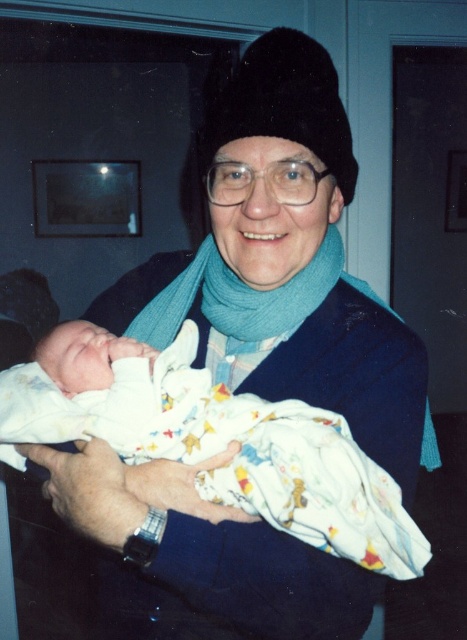
Question: Is white cotton swaddle at center to the right of teal soft scarf at center from the viewer's perspective?

Choices:
 (A) no
 (B) yes

Answer: (A)

Question: Which object is the farthest from the teal soft scarf at center?

Choices:
 (A) white cotton swaddle at center
 (B) black fuzzy hat at center

Answer: (B)

Question: Based on their relative distances, which object is nearer to the white cotton swaddle at center?

Choices:
 (A) teal soft scarf at center
 (B) black fuzzy hat at center

Answer: (A)

Question: Is black fuzzy hat at center to the right of teal soft scarf at center from the viewer's perspective?

Choices:
 (A) no
 (B) yes

Answer: (B)

Question: Which of the following is the farthest from the observer?

Choices:
 (A) white cotton swaddle at center
 (B) black fuzzy hat at center

Answer: (B)

Question: Is white cotton swaddle at center wider than teal soft scarf at center?

Choices:
 (A) no
 (B) yes

Answer: (B)